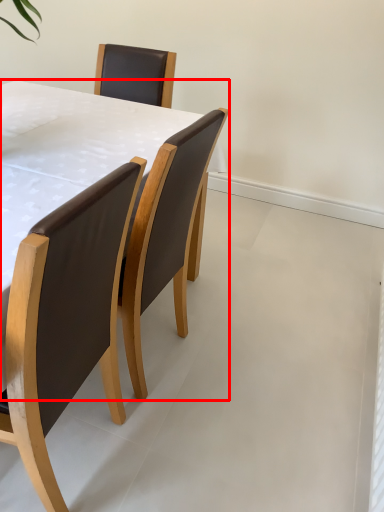
Question: From the image's perspective, where is table (annotated by the red box) located in relation to chair in the image?

Choices:
 (A) above
 (B) below

Answer: (A)